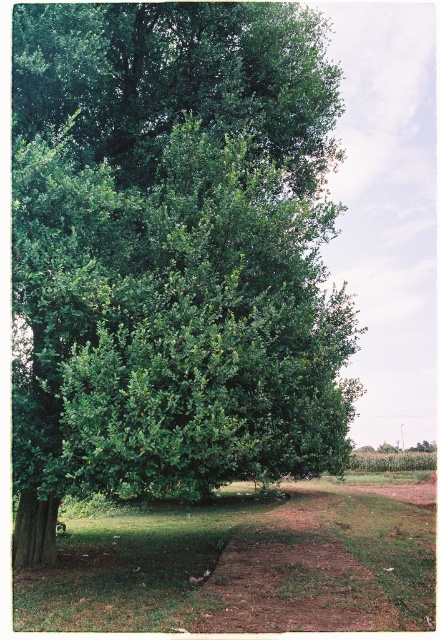
Does green leafy tree at center have a smaller size compared to green leafy grass at lower center?

Yes.

Who is shorter, green leafy tree at center or green leafy grass at lower center?

green leafy tree at center

Find the location of a particular element. The image size is (440, 640). green leafy tree at center is located at coordinates (173, 253).

Is green leafy grass at lower center smaller than green leafy tree at upper center?

Actually, green leafy grass at lower center might be larger than green leafy tree at upper center.

Does green leafy grass at lower center appear under green leafy tree at upper center?

Correct, green leafy grass at lower center is located below green leafy tree at upper center.

The height and width of the screenshot is (640, 440). I want to click on green leafy grass at lower center, so click(x=242, y=566).

Is point (79, 182) farther from viewer compared to point (24, 108)?

That is False.

Which is above, green leafy tree at center or green leafy tree at upper center?

green leafy tree at upper center is above.

This screenshot has width=440, height=640. I want to click on green leafy tree at center, so click(173, 253).